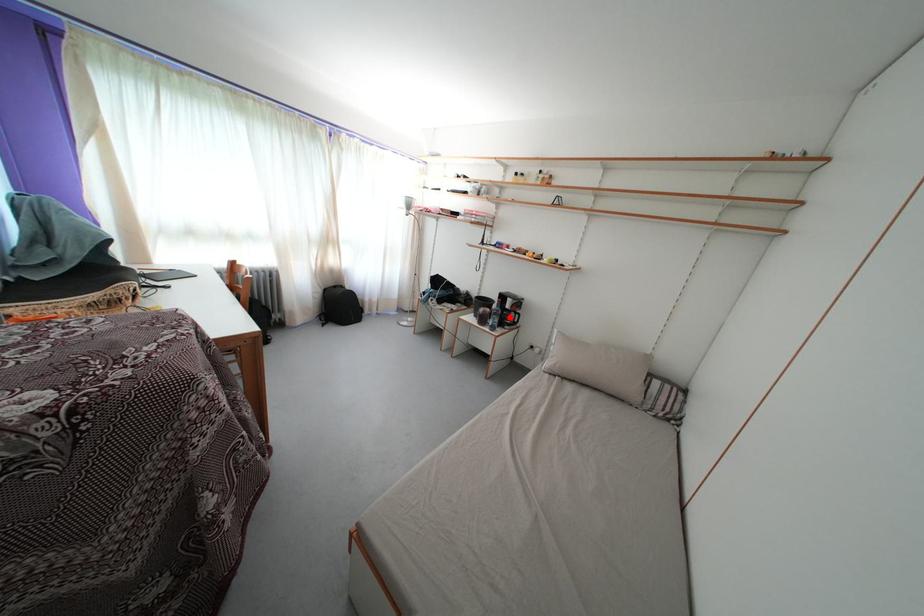
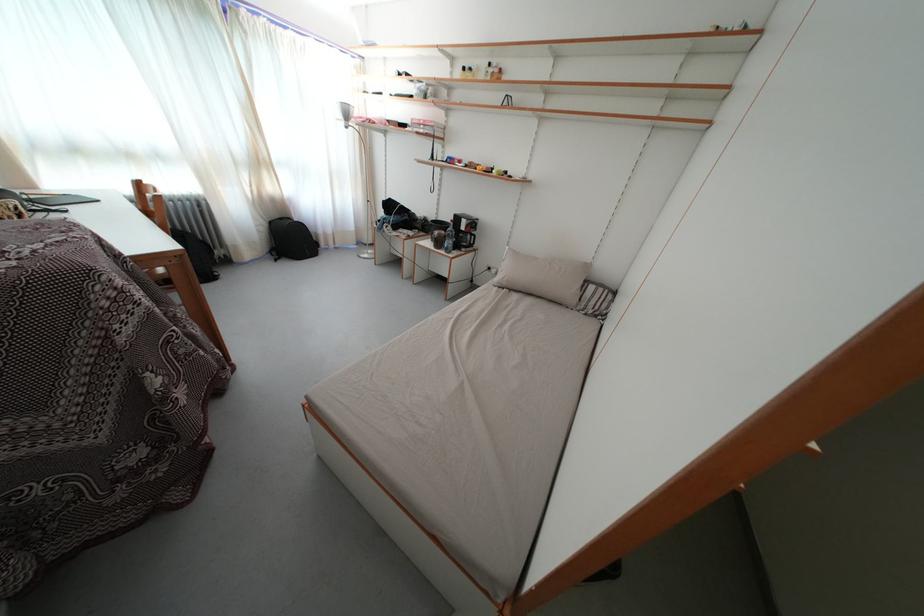
Question: A red point is marked in image1. In image2, is the corresponding 3D point closer to the camera or farther? Reply with the corresponding letter.

Choices:
 (A) The corresponding 3D point is closer.
 (B) The corresponding 3D point is farther.

Answer: (A)